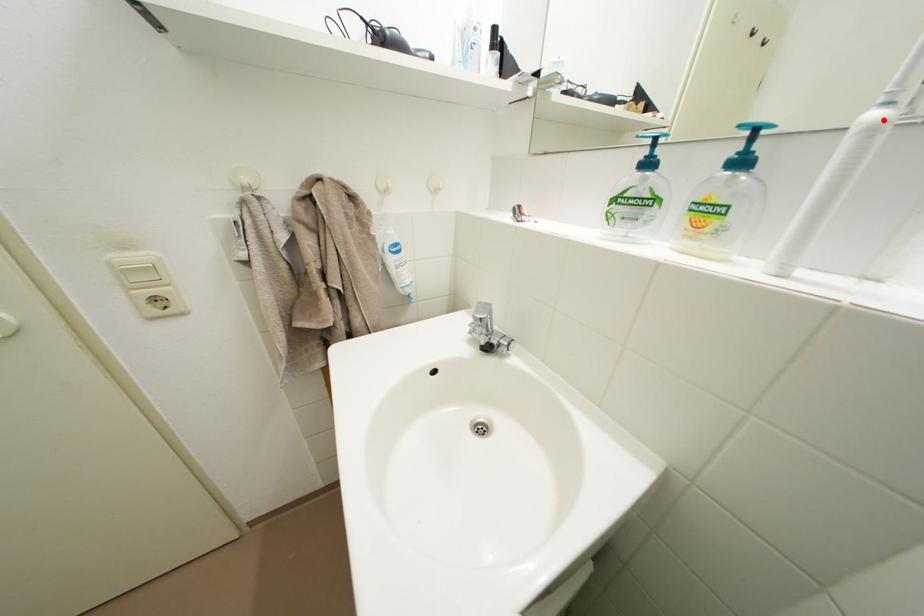
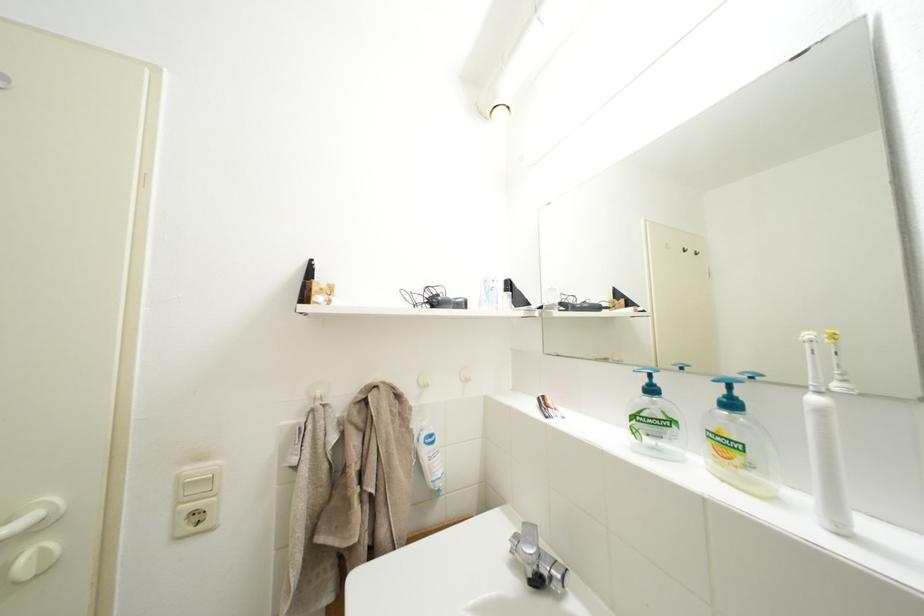
Where in the second image is the point corresponding to the highlighted location from the first image?

(823, 405)